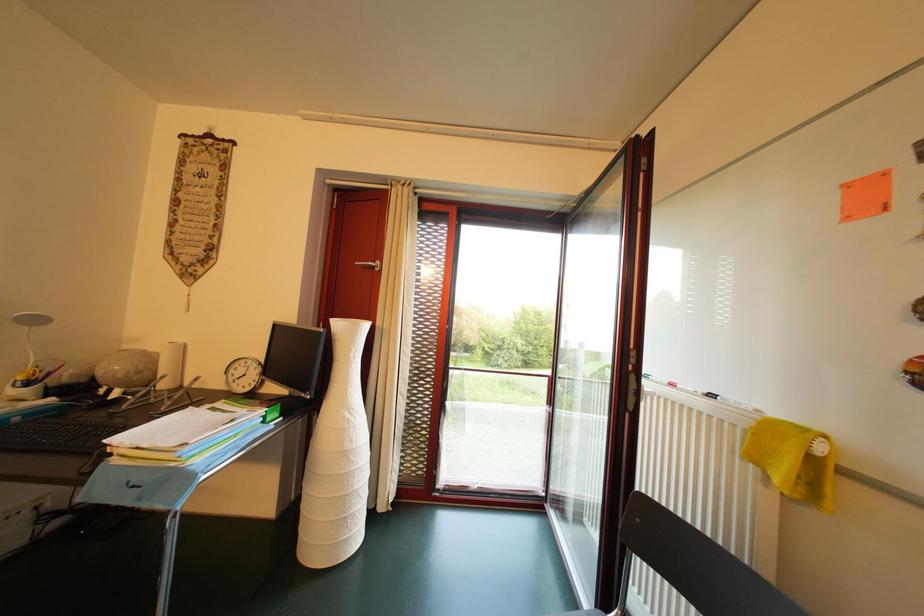
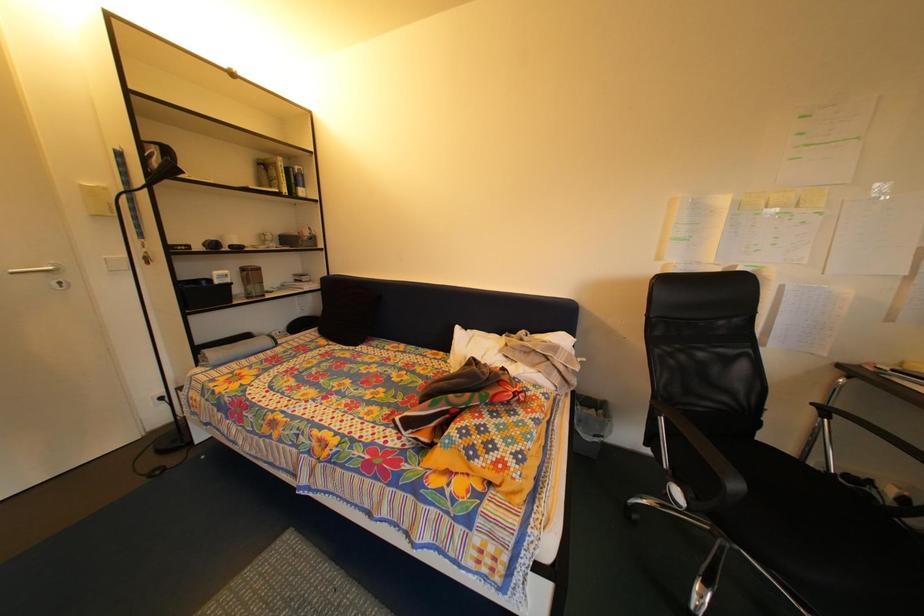
Question: The camera is either moving clockwise (left) or counter-clockwise (right) around the object. The first image is from the beginning of the video and the second image is from the end. Is the camera moving left or right when shooting the video?

Choices:
 (A) Left
 (B) Right

Answer: (B)